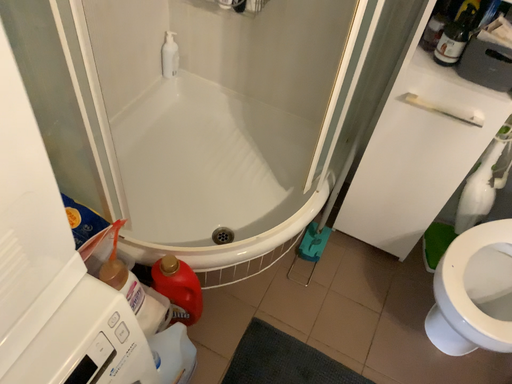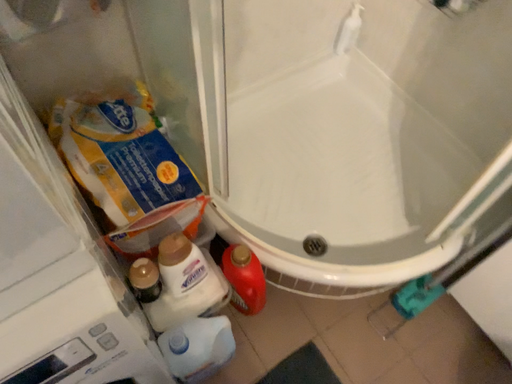
Question: How did the camera likely rotate when shooting the video?

Choices:
 (A) rotated left
 (B) rotated right

Answer: (A)